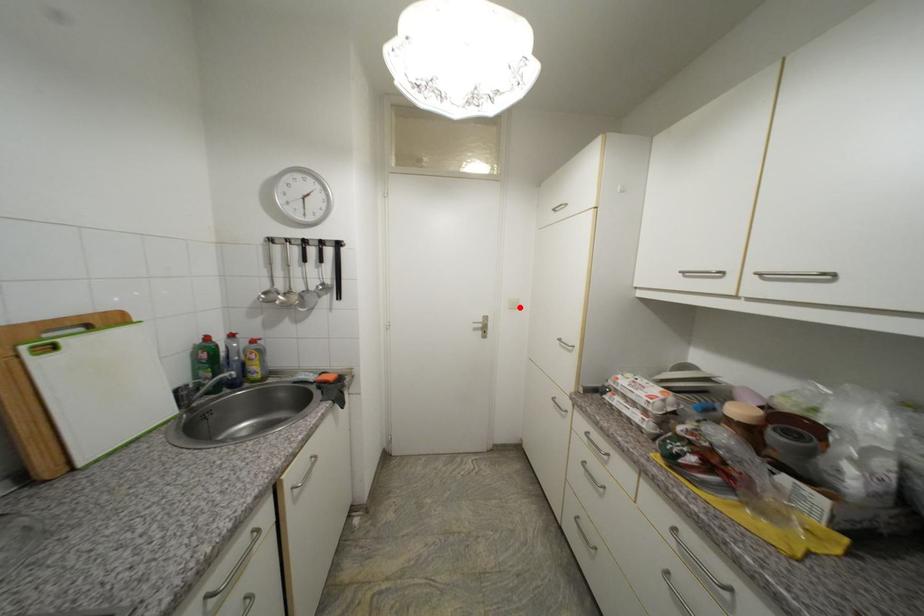
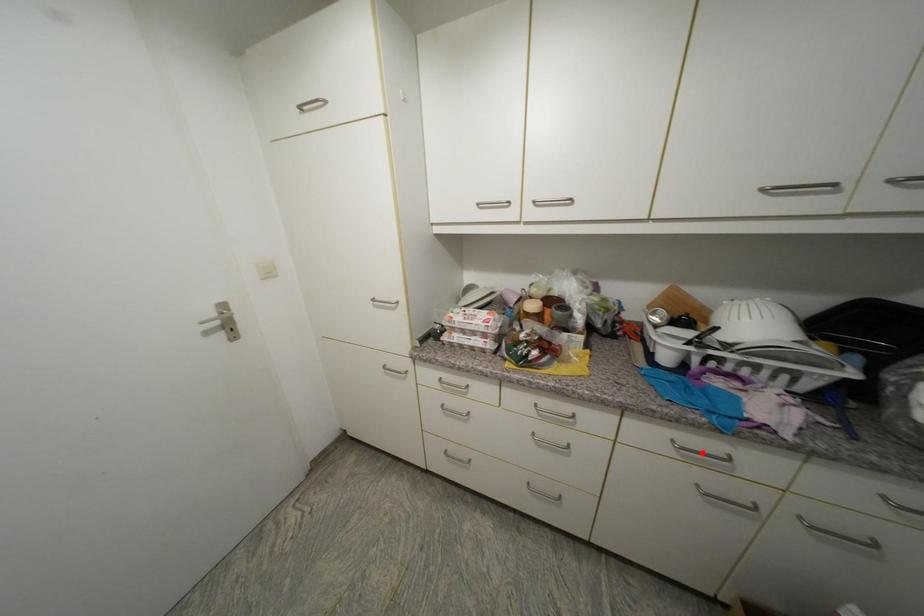
I am providing you with two images of the same scene from different viewpoints. A red point is marked on the first image and another point is marked on the second image. Do the highlighted points in image1 and image2 indicate the same real-world spot?

No